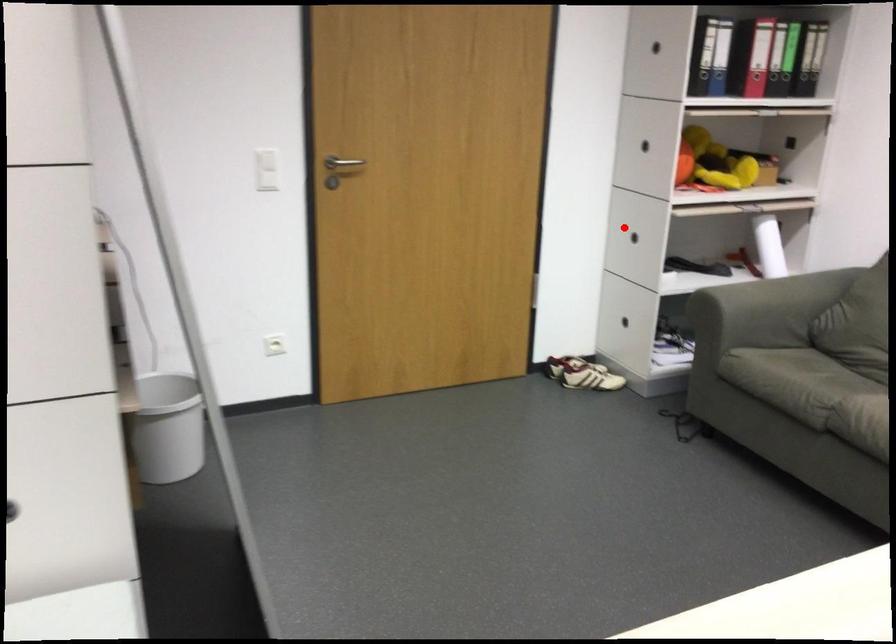
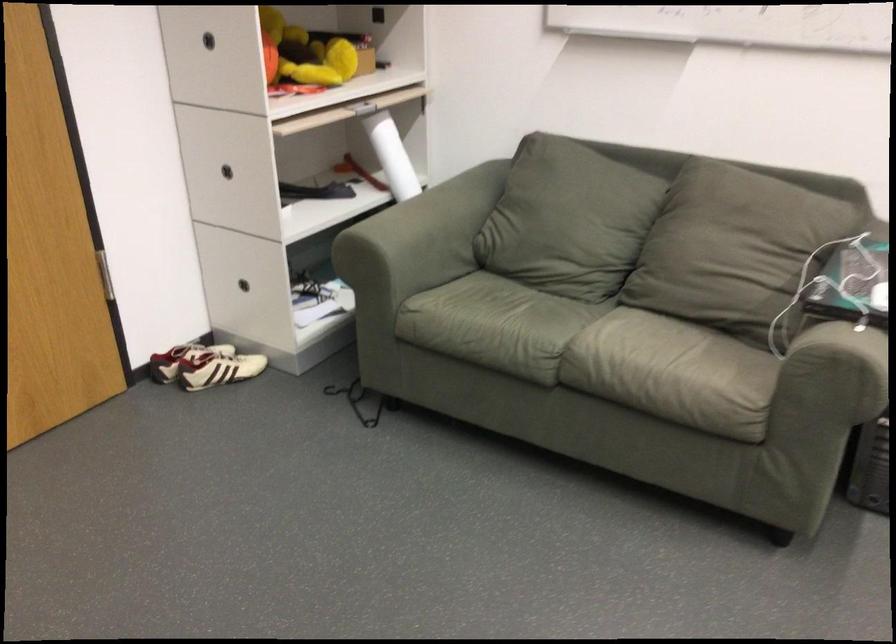
Find the pixel in the second image that matches the highlighted location in the first image.

(227, 171)